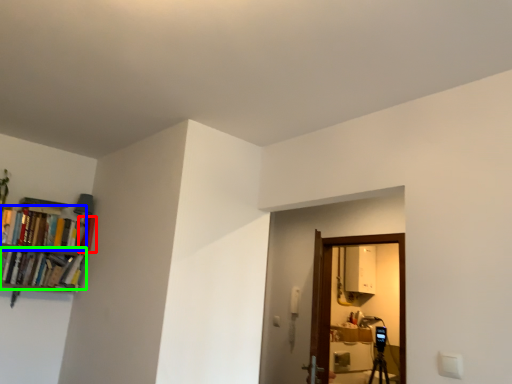
Question: Based on their relative distances, which object is nearer to book (highlighted by a red box)? Choose from book (highlighted by a blue box) and book (highlighted by a green box).

Choices:
 (A) book
 (B) book

Answer: (A)